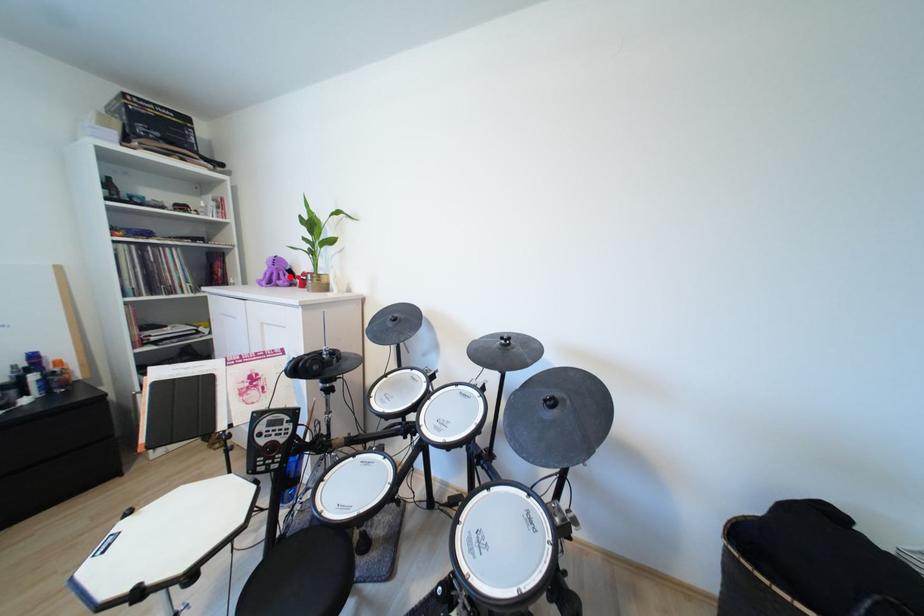
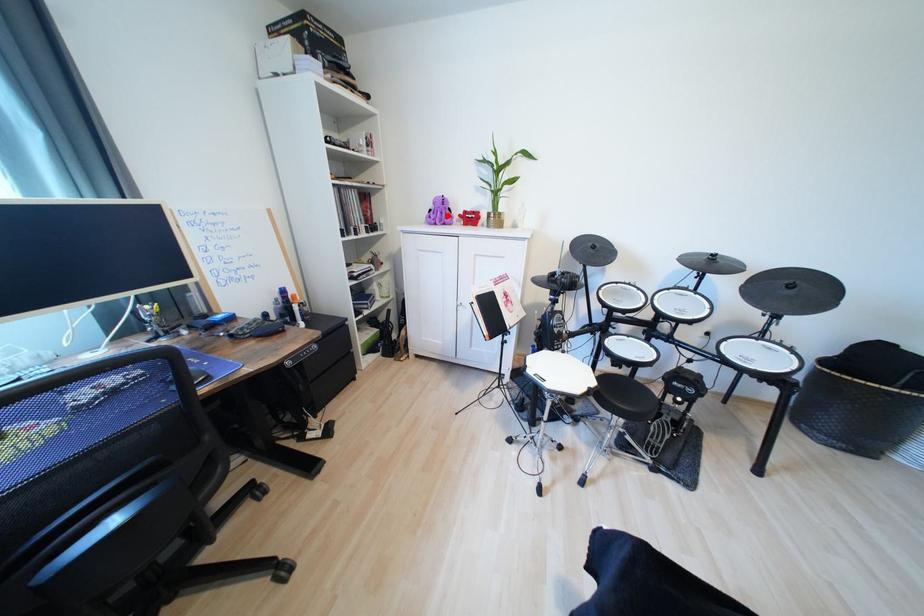
I am providing you with two images of the same scene from different viewpoints. A red point is marked on the first image and another point is marked on the second image. Are the points marked in image1 and image2 representing the same 3D position?

Yes